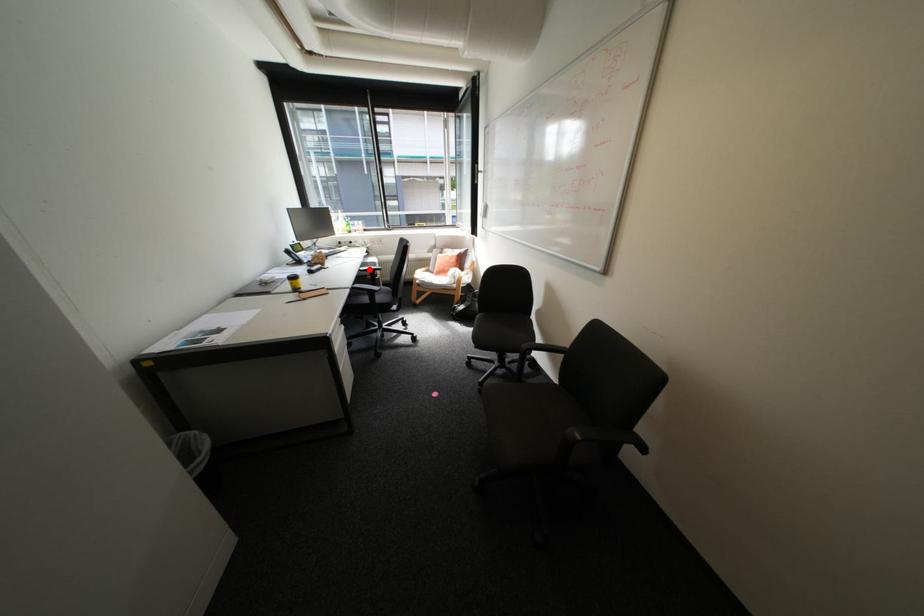
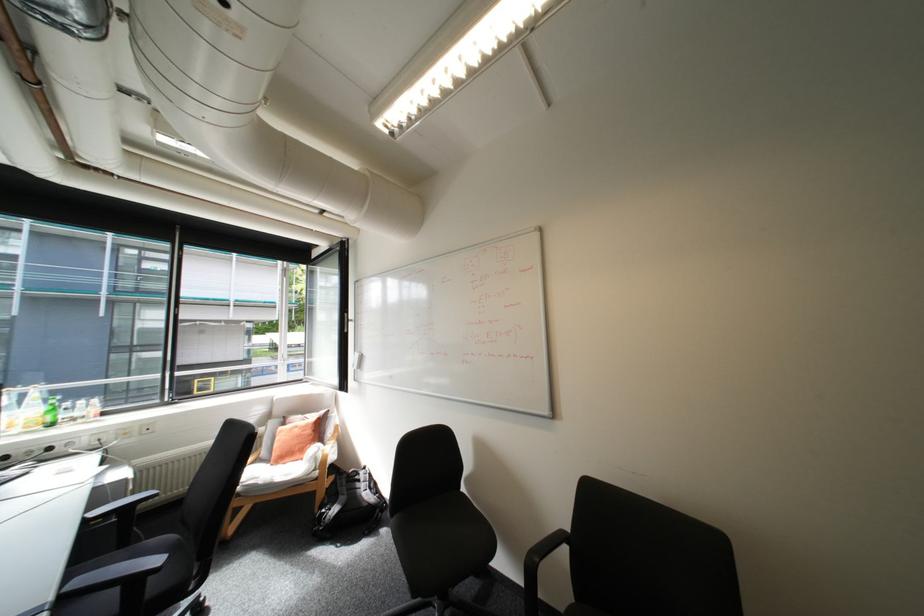
Question: A red point is marked in image1. In image2, is the corresponding 3D point closer to the camera or farther? Reply with the corresponding letter.

Choices:
 (A) The corresponding 3D point is closer.
 (B) The corresponding 3D point is farther.

Answer: (B)